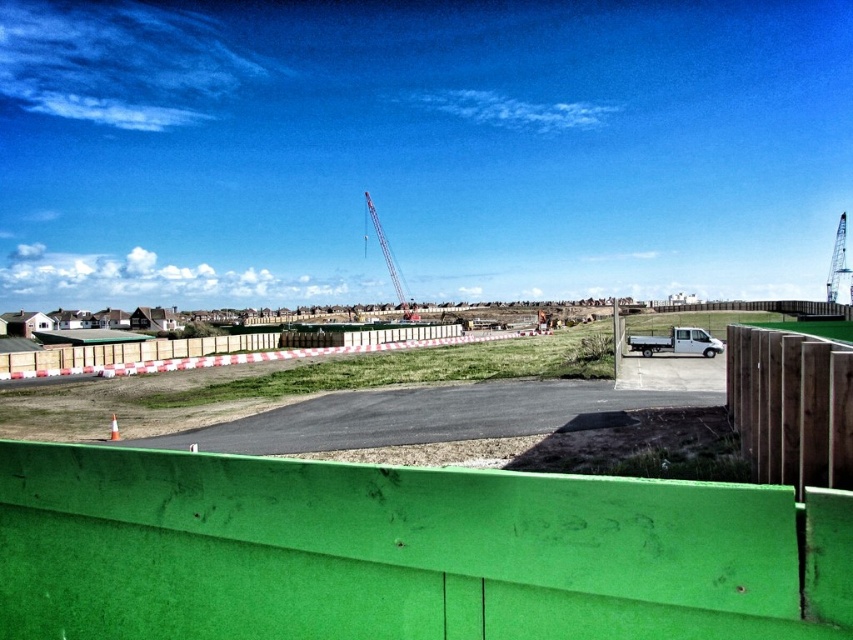
Question: Which point appears closest to the camera in this image?

Choices:
 (A) (805, 440)
 (B) (483, 396)

Answer: (A)

Question: Estimate the real-world distances between objects in this image. Which object is closer to the green painted wood at lower center?

Choices:
 (A) wooden fence at center
 (B) brown dirt track at center

Answer: (B)

Question: Considering the relative positions of wooden fence at center and metallic silver crane at center in the image provided, where is wooden fence at center located with respect to metallic silver crane at center?

Choices:
 (A) below
 (B) above

Answer: (A)

Question: Which point is closer to the camera?

Choices:
 (A) metallic gray crane at upper right
 (B) brown fabric construction worker at center
 (C) green painted wood at lower center

Answer: (C)

Question: Can you confirm if wooden fence at center is smaller than metallic silver crane at center?

Choices:
 (A) no
 (B) yes

Answer: (A)

Question: Is green painted wood at lower center to the right of metallic gray crane at upper right from the viewer's perspective?

Choices:
 (A) no
 (B) yes

Answer: (A)